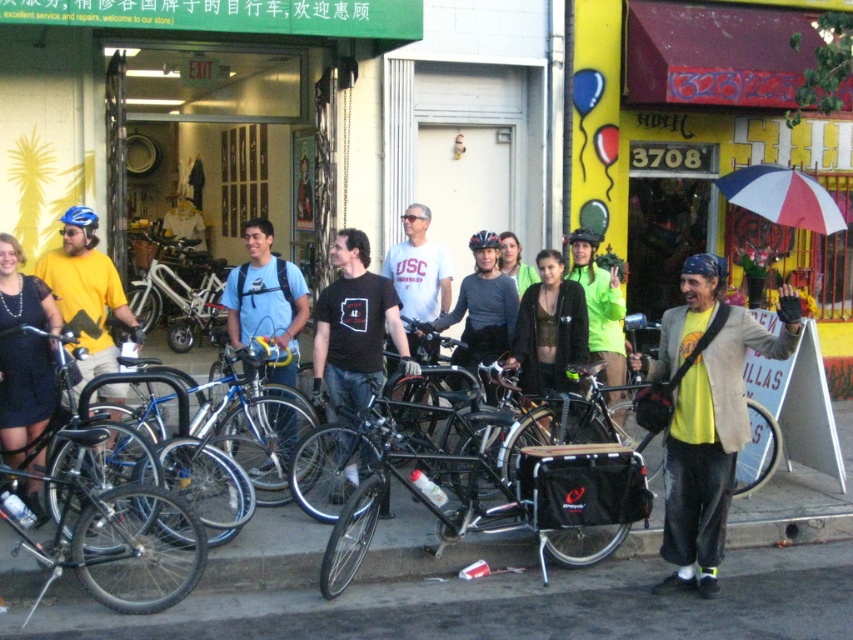
Question: Which point is closer to the camera?

Choices:
 (A) metallic gold jacket at center
 (B) black matte t-shirt at center
 (C) concrete pavement at center
 (D) yellow matte shirt at left

Answer: (C)

Question: Which is nearer to the black matte bicycle at center?

Choices:
 (A) yellow matte shirt at center
 (B) black matte t-shirt at center
 (C) matte black dress at left

Answer: (B)

Question: Which object is closer to the camera taking this photo?

Choices:
 (A) white matte t-shirt at center
 (B) black matte t-shirt at center
 (C) black matte bicycle at center
 (D) red and white striped umbrella at right

Answer: (C)

Question: Can you confirm if matte black dress at left is positioned to the right of red and white striped umbrella at right?

Choices:
 (A) no
 (B) yes

Answer: (A)

Question: Can you confirm if concrete pavement at center is positioned above yellow matte shirt at center?

Choices:
 (A) no
 (B) yes

Answer: (A)

Question: Does concrete pavement at center appear on the right side of metallic gold jacket at center?

Choices:
 (A) yes
 (B) no

Answer: (B)